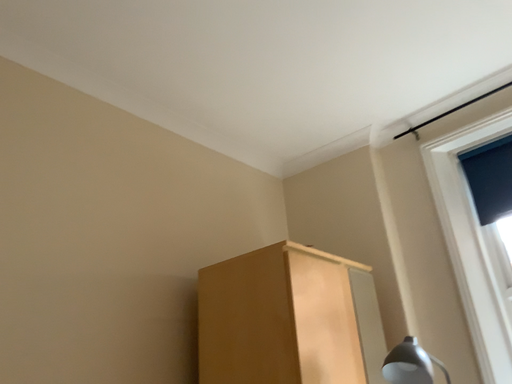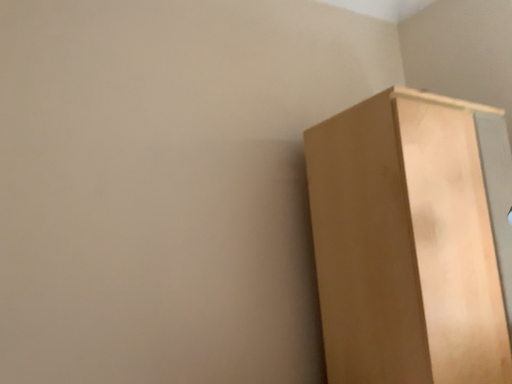
Question: Which way did the camera rotate in the video?

Choices:
 (A) rotated right
 (B) rotated left

Answer: (B)